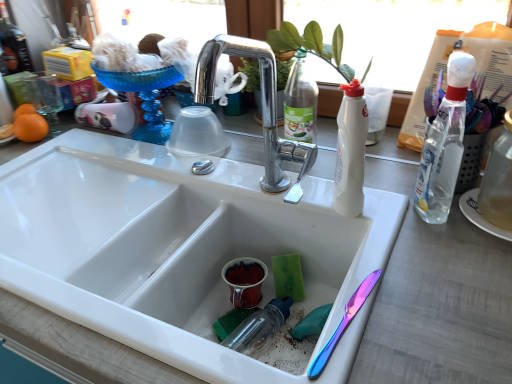
This screenshot has height=384, width=512. What are the coordinates of `vacant region above white glossy sink at center (from a real-world perspective)` in the screenshot? It's located at (109, 195).